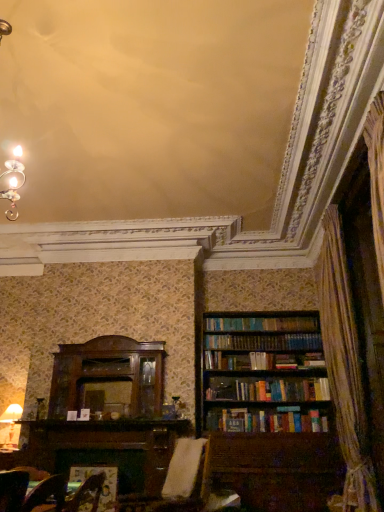
Question: In terms of height, does white fabric swivel chair at center look taller or shorter compared to brown wooden bookcase at right?

Choices:
 (A) short
 (B) tall

Answer: (A)

Question: Is white fabric swivel chair at center spatially inside brown wooden bookcase at right, or outside of it?

Choices:
 (A) inside
 (B) outside

Answer: (B)

Question: Considering the real-world distances, which object is farthest from the white fabric swivel chair at center?

Choices:
 (A) matte white lampshade at lower left
 (B) brown wooden bookcase at right
 (C) velvet brown armchair at lower center

Answer: (B)

Question: Considering the real-world distances, which object is farthest from the velvet brown armchair at lower center?

Choices:
 (A) white fabric swivel chair at center
 (B) brown wooden bookcase at right
 (C) matte white lampshade at lower left

Answer: (B)